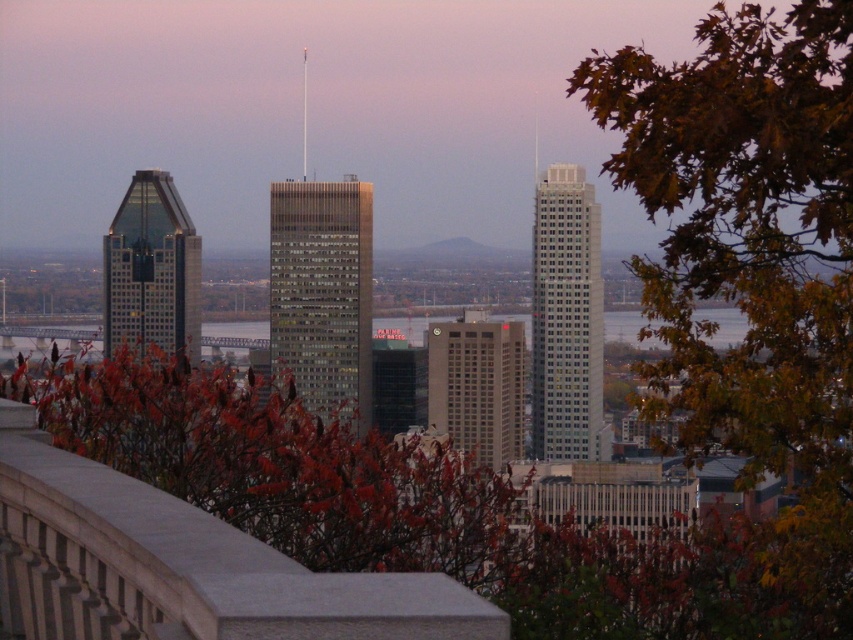
Question: Is glassy reflective skyscraper at left above beige concrete building at center?

Choices:
 (A) no
 (B) yes

Answer: (B)

Question: Is brown leafy tree at upper right positioned in front of glassy gray skyscraper at center?

Choices:
 (A) yes
 (B) no

Answer: (B)

Question: Which object is the farthest from the glassy reflective skyscraper at left?

Choices:
 (A) brown leafy tree at upper right
 (B) beige concrete building at center

Answer: (A)

Question: Which point appears closest to the camera in this image?

Choices:
 (A) (601, 396)
 (B) (647, 90)

Answer: (A)

Question: Considering the real-world distances, which object is closest to the glassy gray skyscraper at center?

Choices:
 (A) beige concrete building at center
 (B) glassy reflective skyscraper at left
 (C) brown leafy tree at upper right
 (D) sleek silver skyscraper at center

Answer: (A)

Question: Does brown leafy tree at upper right come behind glassy gray skyscraper at center?

Choices:
 (A) yes
 (B) no

Answer: (A)